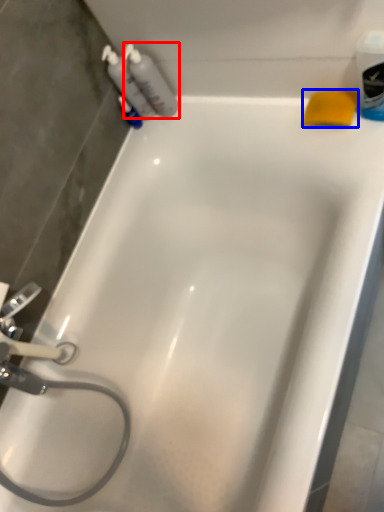
Question: Which of the following is the closest to the observer, cleaning product (highlighted by a red box) or soap (highlighted by a blue box)?

Choices:
 (A) cleaning product
 (B) soap

Answer: (B)